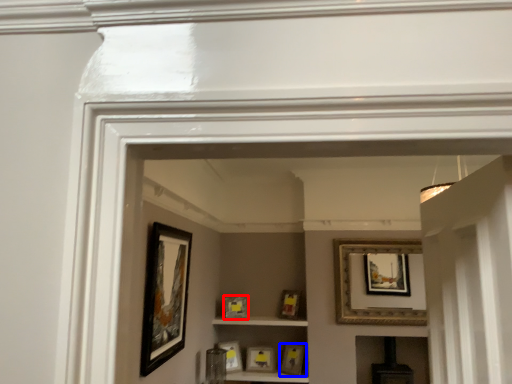
Question: Which object appears farthest to the camera in this image, picture frame (highlighted by a red box) or picture frame (highlighted by a blue box)?

Choices:
 (A) picture frame
 (B) picture frame

Answer: (A)